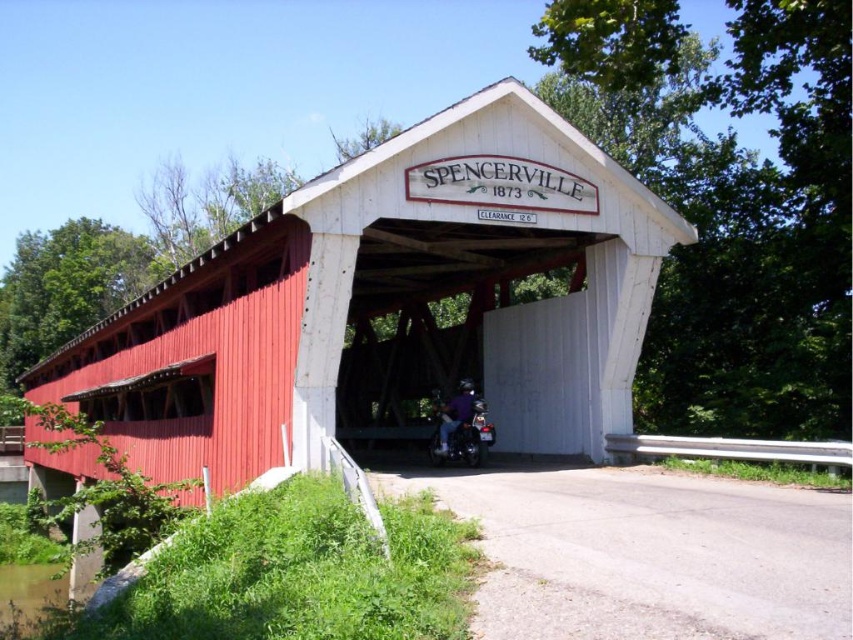
Question: Is red corrugated metal bridge at center to the right of shiny black motorcycle at center from the viewer's perspective?

Choices:
 (A) yes
 (B) no

Answer: (B)

Question: Among these points, which one is nearest to the camera?

Choices:
 (A) (467, 440)
 (B) (438, 237)

Answer: (A)

Question: Considering the relative positions of red corrugated metal bridge at center and shiny black motorcycle at center in the image provided, where is red corrugated metal bridge at center located with respect to shiny black motorcycle at center?

Choices:
 (A) left
 (B) right

Answer: (A)

Question: Which of the following is the farthest from the observer?

Choices:
 (A) shiny black motorcycle at center
 (B) red corrugated metal bridge at center

Answer: (A)

Question: Can you confirm if red corrugated metal bridge at center is positioned below shiny black motorcycle at center?

Choices:
 (A) yes
 (B) no

Answer: (A)

Question: Which object appears farthest from the camera in this image?

Choices:
 (A) shiny black motorcycle at center
 (B) red corrugated metal bridge at center

Answer: (A)